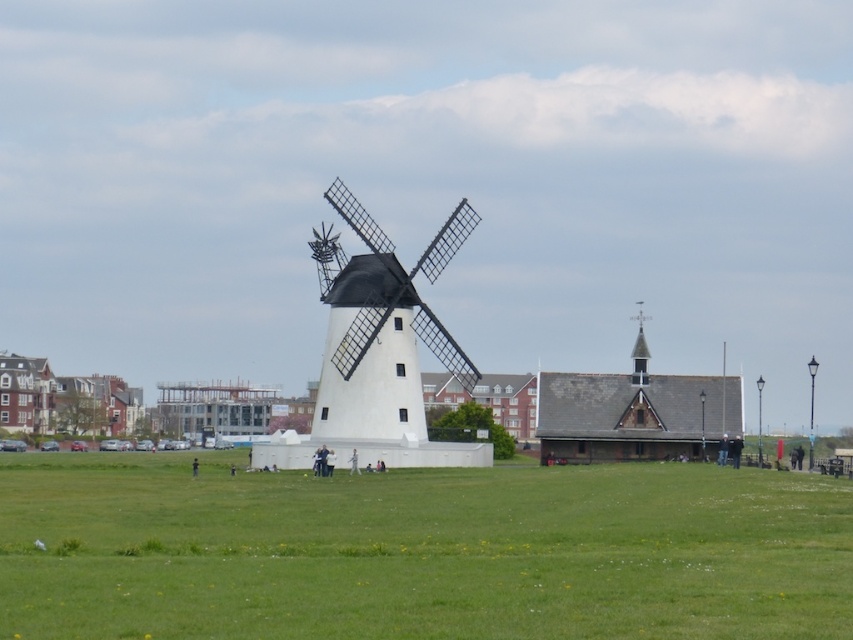
Which is above, green grass at center or white matte windmill at center?

white matte windmill at center is above.

Locate an element on the screen. Image resolution: width=853 pixels, height=640 pixels. green grass at center is located at coordinates (419, 552).

Who is more distant from viewer, [193,586] or [393,284]?

Positioned behind is point [393,284].

Find the location of a particular element. The width and height of the screenshot is (853, 640). green grass at center is located at coordinates (419, 552).